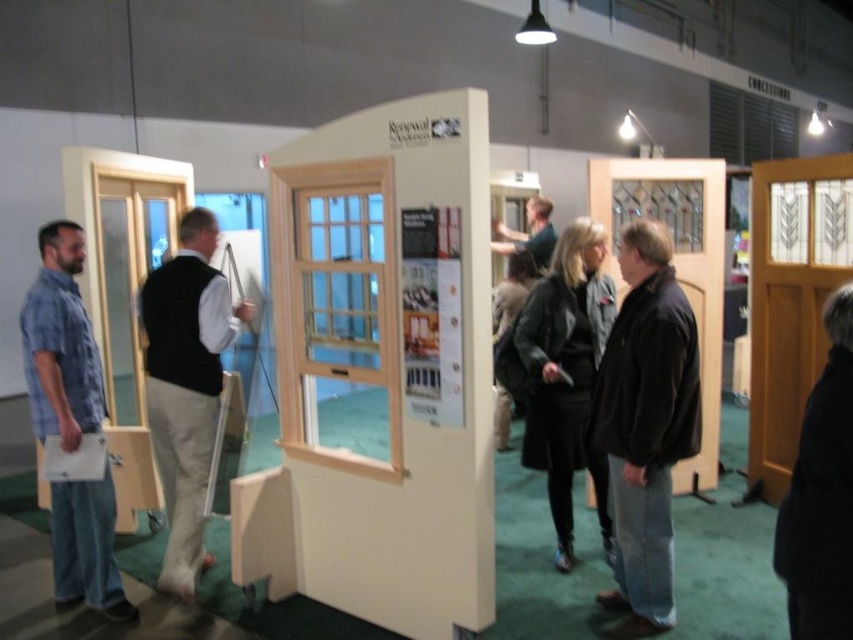
Does point (549, 308) come in front of point (535, 195)?

Yes, it is in front of point (535, 195).

Does black leather jacket at center appear under dark blue shirt at center?

Yes.

Which is behind, point (596, 320) or point (547, 252)?

The point (547, 252) is behind.

Find the location of a particular element. The height and width of the screenshot is (640, 853). black leather jacket at center is located at coordinates (566, 372).

From the picture: Does blue denim jeans at left have a greater height compared to dark brown leather jacket at center?

Yes, blue denim jeans at left is taller than dark brown leather jacket at center.

Is blue denim jeans at left positioned at the back of dark brown leather jacket at center?

That is False.

What are the coordinates of `blue denim jeans at left` in the screenshot? It's located at (61, 342).

Identify the location of blue denim jeans at left. The image size is (853, 640). click(61, 342).

Is dark brown leather jacket at center taller than dark blue shirt at center?

Correct, dark brown leather jacket at center is much taller as dark blue shirt at center.

Does dark brown leather jacket at center have a lesser height compared to dark blue shirt at center?

Incorrect, dark brown leather jacket at center's height does not fall short of dark blue shirt at center's.

What do you see at coordinates (511, 291) in the screenshot? I see `dark brown leather jacket at center` at bounding box center [511, 291].

The image size is (853, 640). What are the coordinates of `dark brown leather jacket at center` in the screenshot? It's located at (511, 291).